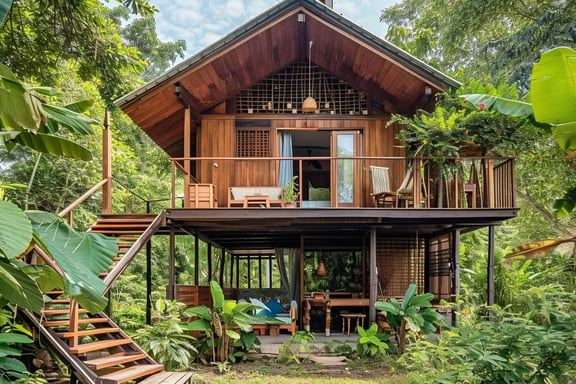
Where is `chair`? This screenshot has width=576, height=384. chair is located at coordinates (380, 181).